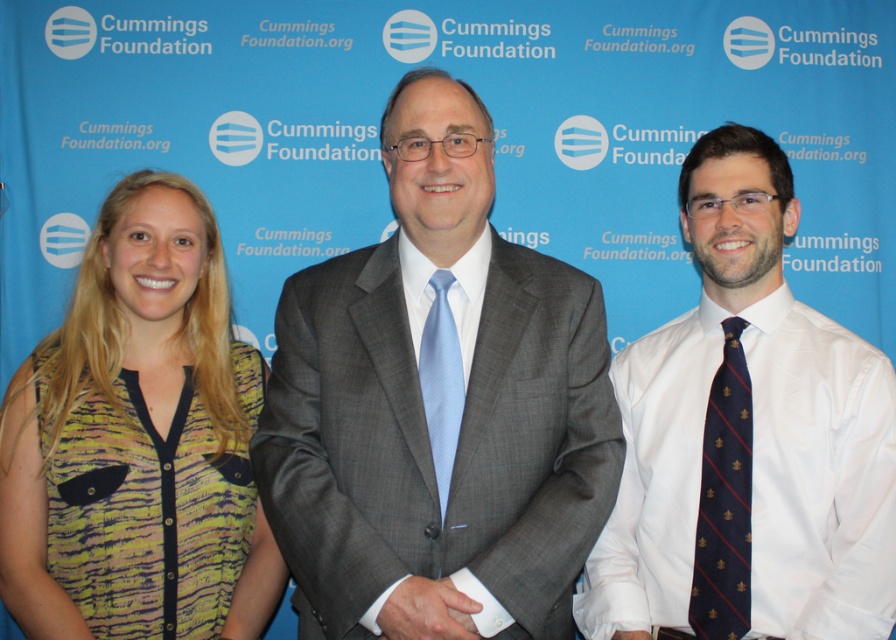
Is light blue silk tie at center smaller than white satin cuff at center?

No.

Describe the element at coordinates (441, 381) in the screenshot. The height and width of the screenshot is (640, 896). I see `light blue silk tie at center` at that location.

Identify the location of light blue silk tie at center. The image size is (896, 640). (441, 381).

The height and width of the screenshot is (640, 896). Describe the element at coordinates (437, 401) in the screenshot. I see `gray textured suit at center` at that location.

Does gray textured suit at center appear on the right side of navy blue silk tie at right?

In fact, gray textured suit at center is to the left of navy blue silk tie at right.

Is point (322, 272) in front of point (721, 513)?

No, (322, 272) is further to viewer.

This screenshot has width=896, height=640. What are the coordinates of `gray textured suit at center` in the screenshot? It's located at [437, 401].

Which is below, white satin shirt at center or printed fabric blouse at left?

printed fabric blouse at left

Is point (683, 410) positioned behind point (132, 465)?

Yes.

At what (x,y) coordinates should I click in order to perform the action: click on white satin shirt at center. Please return your answer as a coordinate pair (x, y). Looking at the image, I should click on (747, 440).